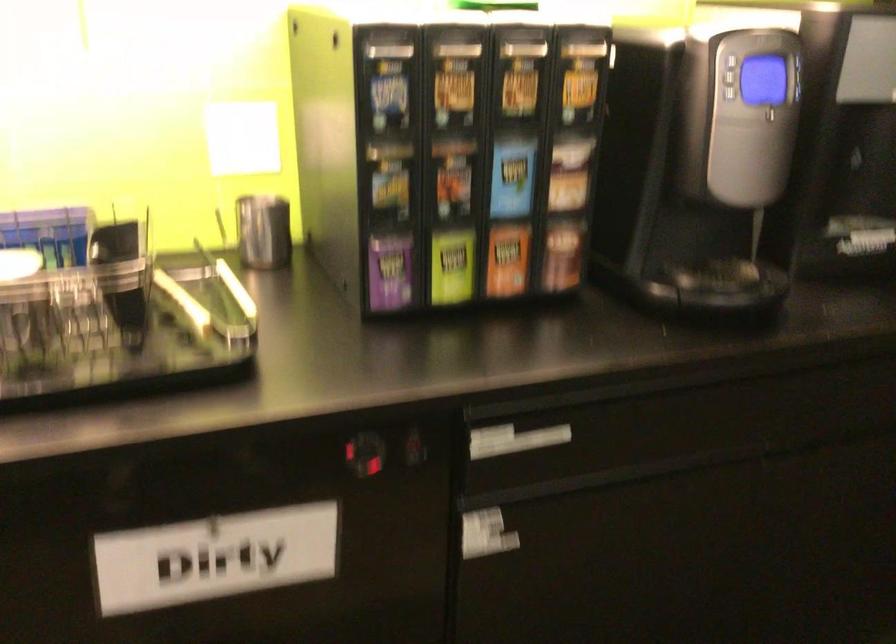
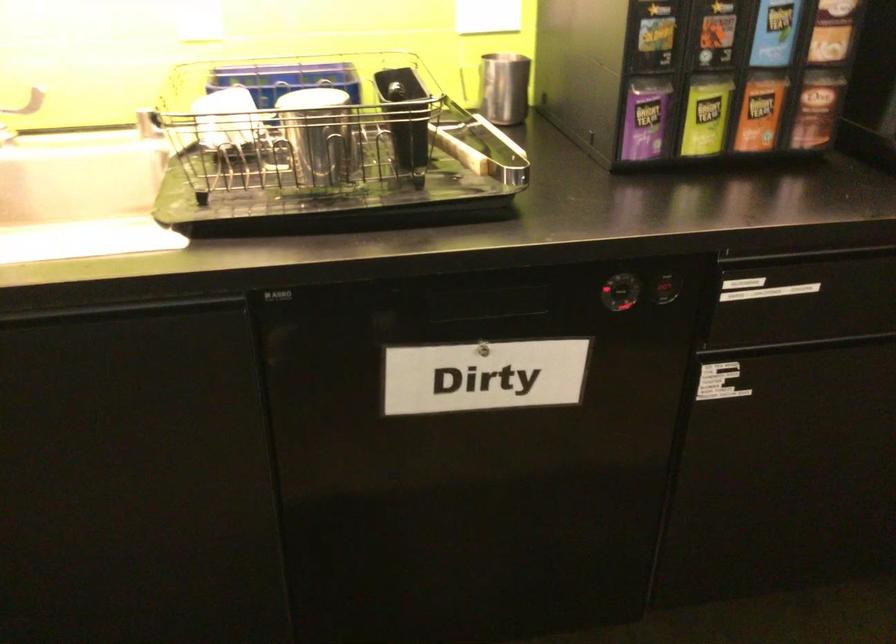
Locate, in the second image, the point that corresponds to point (365, 456) in the first image.

(623, 290)